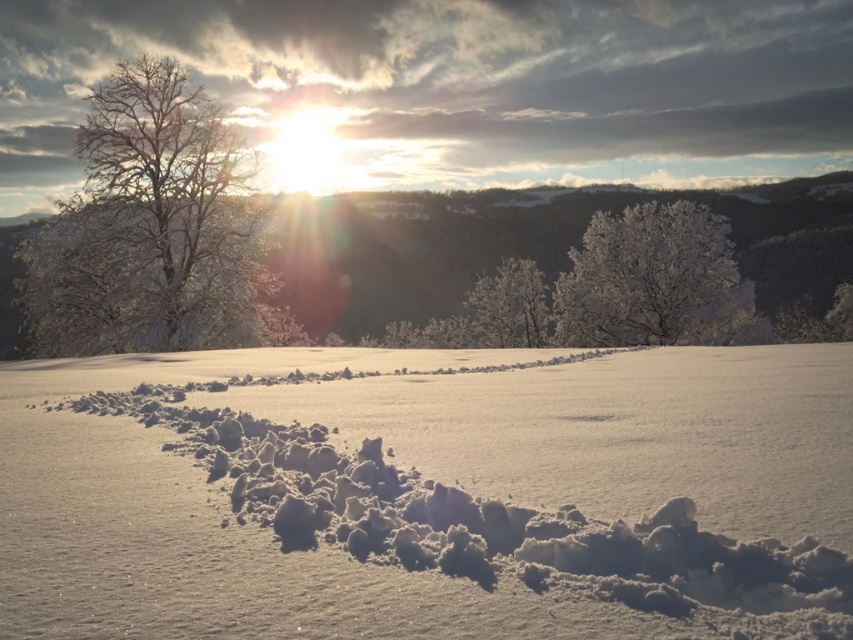
Question: Among these points, which one is farthest from the camera?

Choices:
 (A) (738, 307)
 (B) (502, 337)
 (C) (235, 284)

Answer: (B)

Question: Which point is closer to the camera?

Choices:
 (A) snow-covered tree at left
 (B) white fluffy snow at center

Answer: (B)

Question: Does white fluffy snow at center have a greater width compared to snow-covered tree at left?

Choices:
 (A) yes
 (B) no

Answer: (B)

Question: Which point is closer to the camera?

Choices:
 (A) (538, 323)
 (B) (450, 493)
 (C) (627, 269)

Answer: (B)

Question: Is frosted white tree at upper center bigger than frosted white tree at center?

Choices:
 (A) yes
 (B) no

Answer: (A)

Question: Does frosted white tree at upper center have a greater width compared to frosted white tree at center?

Choices:
 (A) no
 (B) yes

Answer: (B)